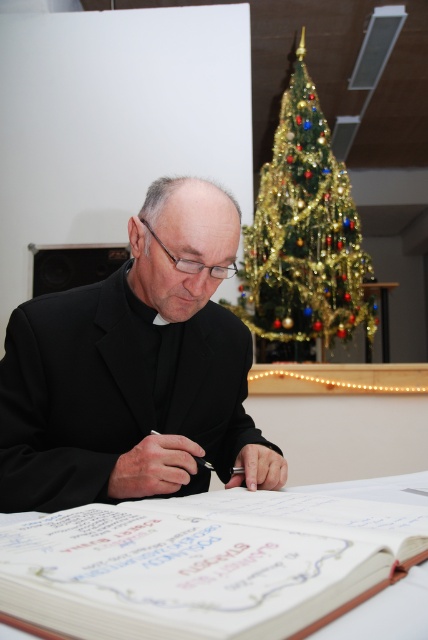
How distant is black matte suit at center from green glittery christmas tree at upper center?

black matte suit at center is 2.02 meters away from green glittery christmas tree at upper center.

Who is lower down, black matte suit at center or green glittery christmas tree at upper center?

black matte suit at center

Who is more forward, (x=181, y=348) or (x=279, y=180)?

Point (x=181, y=348) is more forward.

The width and height of the screenshot is (428, 640). Find the location of `black matte suit at center`. black matte suit at center is located at coordinates point(134,371).

Does white paper book at center appear over green glittery christmas tree at upper center?

No.

Identify the location of white paper book at center. (202, 563).

Based on the photo, can you confirm if black matte suit at center is wider than white paper book at center?

Incorrect, black matte suit at center's width does not surpass white paper book at center's.

Who is higher up, black matte suit at center or white paper book at center?

Positioned higher is black matte suit at center.

Which is in front, point (110, 372) or point (92, 508)?

Point (92, 508)

Where is `black matte suit at center`? black matte suit at center is located at coordinates (134, 371).